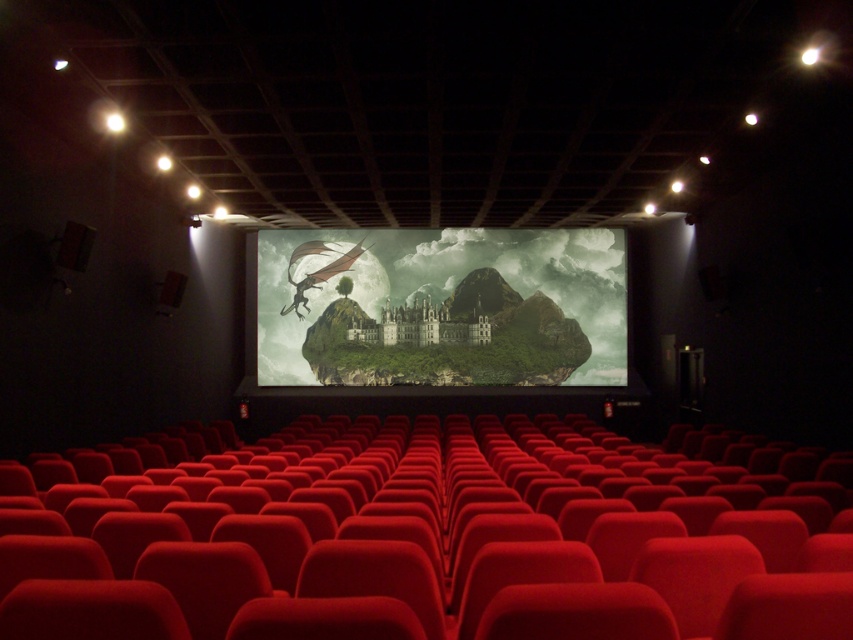
You are sitting in the velvet red seat at center and want to reach the concession stand located at the back of the theater. The theater has a clear path from your seat to the back. If you walk straight backward from your seat, will you reach the concession stand before walking 12 feet?

The velvet red seat at center is 10.29 feet from viewer. Since the distance to walk backward is 10.29 feet, which is less than 12 feet, you will reach the concession stand before walking 12 feet.

You are planning to place a large popcorn bucket on the available space between the velvet red seat at center and the green matte island at center. Based on their widths, which object should you place the popcorn bucket closer to?

The velvet red seat at center has a lesser width compared to the green matte island at center. Therefore, you should place the popcorn bucket closer to the velvet red seat at center to ensure it fits properly.

You are sitting in the velvet red seat at center and want to move to the green matte island at center. Which direction should you walk to reach it?

The velvet red seat at center is to the left of the green matte island at center, so you should walk to the right to reach it.